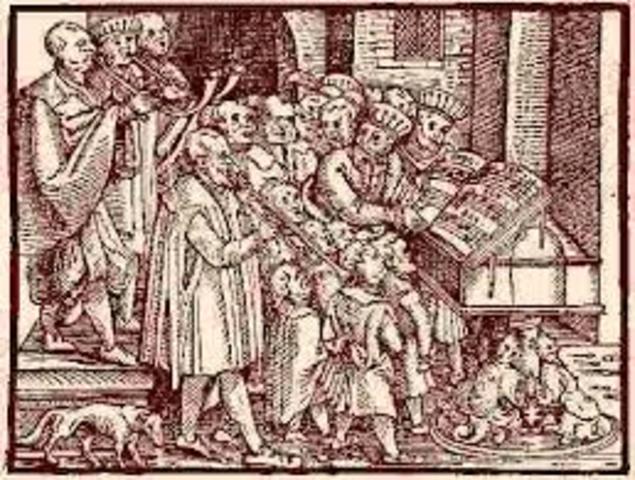
I want to click on right wall, so click(x=587, y=154).